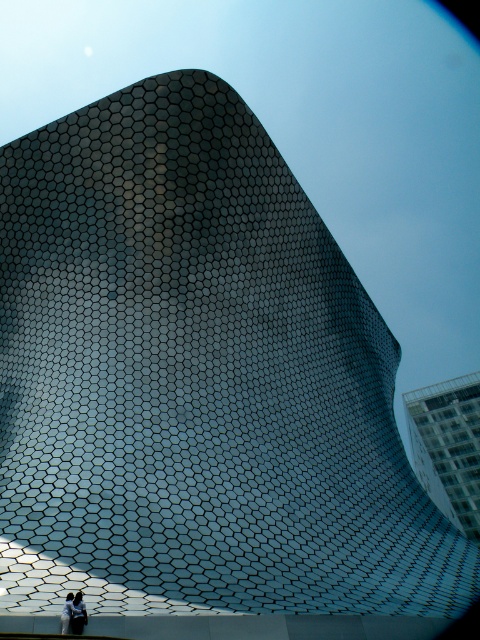
Question: Estimate the real-world distances between objects in this image. Which object is farther from the light blue fabric at center?

Choices:
 (A) glassy reflective building at upper right
 (B) white fabric person at lower left

Answer: (A)

Question: Is white fabric person at lower left positioned before light blue fabric at center?

Choices:
 (A) yes
 (B) no

Answer: (B)

Question: Can you confirm if white fabric person at lower left is positioned to the right of light blue fabric at center?

Choices:
 (A) no
 (B) yes

Answer: (B)

Question: Where is white fabric person at lower left located in relation to light blue fabric at center in the image?

Choices:
 (A) above
 (B) below

Answer: (B)

Question: Which point is closer to the camera?

Choices:
 (A) (71, 602)
 (B) (456, 417)

Answer: (A)

Question: Among these points, which one is farthest from the camera?

Choices:
 (A) (66, 616)
 (B) (456, 492)

Answer: (B)